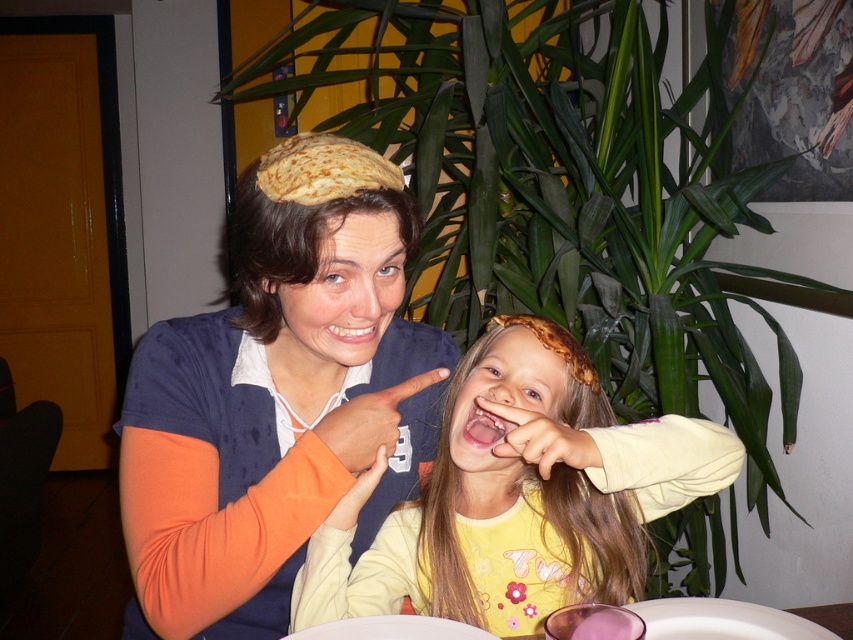
From the picture: You are a photographer taking a picture of the two people at the table. You notice the matte brown beret at upper center and the yellow matte shirt at center. Which object is covering the other?

The matte brown beret at upper center is positioned over the yellow matte shirt at center, so it is covering it.

You are a fashion designer observing the scene. You need to decide which item is better suited for a headpiece design competition. Which object is taller, the matte brown beret at upper center or the yellow matte shirt at center?

The matte brown beret at upper center is taller than the yellow matte shirt at center, so it is better suited for a headpiece design competition as it meets the height requirement.

You are a fashion designer observing the image and want to create a new look using the matte brown beret at upper center and the yellow matte shirt at center. Based on their current positions in the image, which item is located to the left of the other?

The matte brown beret at upper center is positioned on the left side of yellow matte shirt at center.